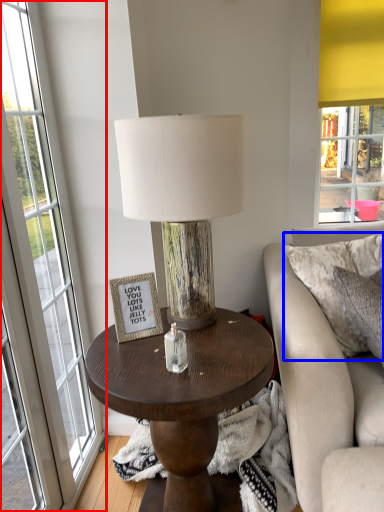
Question: Which point is closer to the camera, window (highlighted by a red box) or pillow (highlighted by a blue box)?

Choices:
 (A) window
 (B) pillow

Answer: (A)